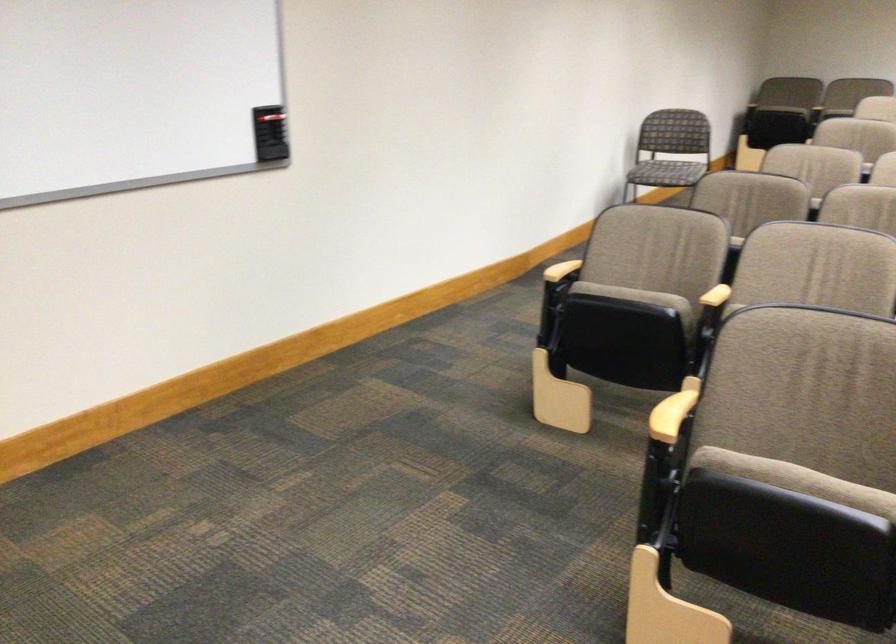
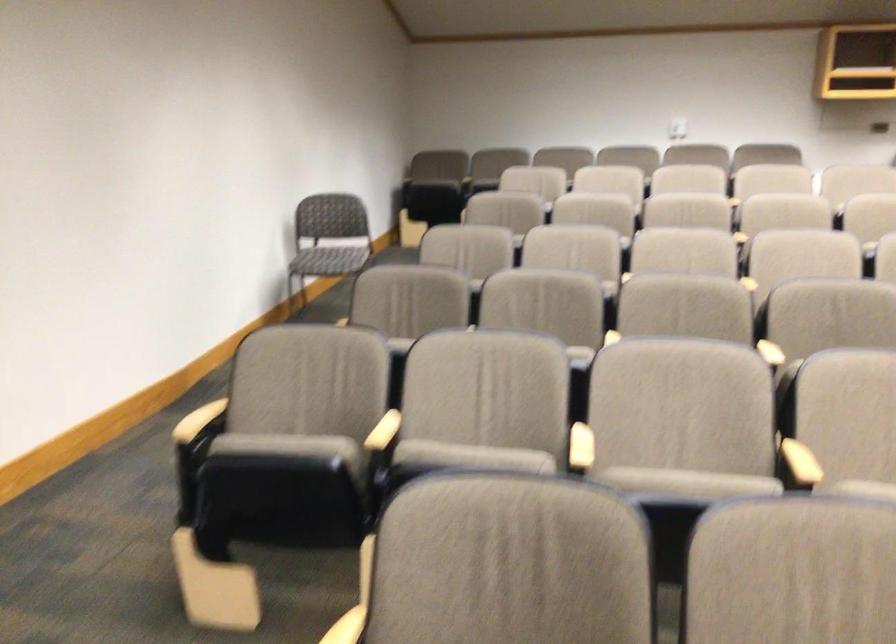
The images are taken continuously from a first-person perspective. In which direction are you moving?

The movement direction of the cameraman is right, forward.